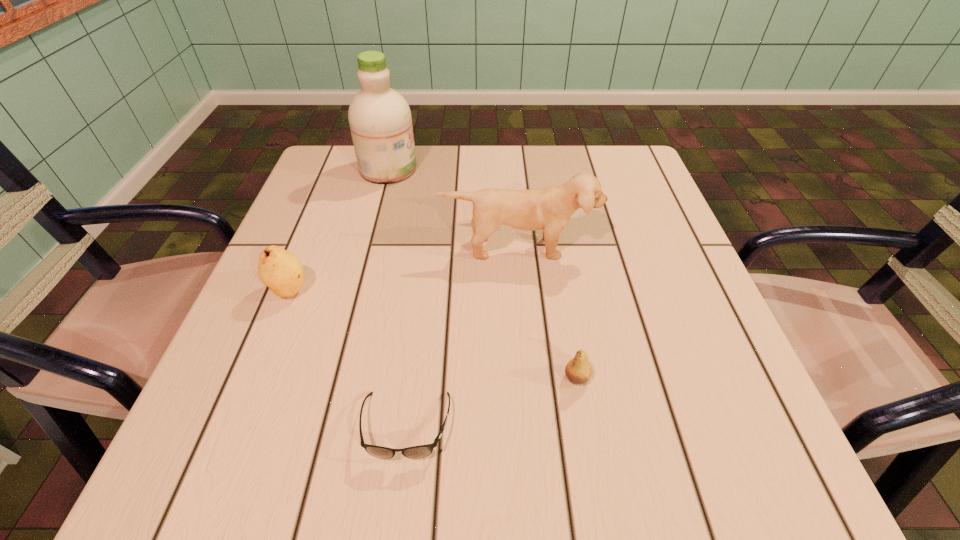
Find the location of a particular element. Image resolution: width=960 pixels, height=540 pixels. free space located on the front label of the tallest object is located at coordinates (468, 168).

Find the location of a particular element. The height and width of the screenshot is (540, 960). free point located on the left side of the second farthest object is located at coordinates [x=534, y=418].

At what (x,y) coordinates should I click in order to perform the action: click on vacant space positioned 0.370m on the back of the leftmost object. Please return your answer as a coordinate pair (x, y). The height and width of the screenshot is (540, 960). Looking at the image, I should click on coord(338,170).

Locate an element on the screen. The image size is (960, 540). vacant space located 0.180m on the right of the second nearest object is located at coordinates (704, 377).

This screenshot has height=540, width=960. What are the coordinates of `object located in the far edge section of the desktop` in the screenshot? It's located at (380, 121).

The height and width of the screenshot is (540, 960). Identify the location of object located in the near edge section of the desktop. (416, 452).

Find the location of a particular element. Image resolution: width=960 pixels, height=540 pixels. cleansing agent that is at the left edge is located at coordinates (380, 121).

Image resolution: width=960 pixels, height=540 pixels. Find the location of `pear present at the left edge`. pear present at the left edge is located at coordinates (280, 270).

The image size is (960, 540). In order to click on object that is positioned at the far left corner in this screenshot , I will do `click(380, 121)`.

Image resolution: width=960 pixels, height=540 pixels. What are the coordinates of `free space at the far edge` in the screenshot? It's located at (555, 171).